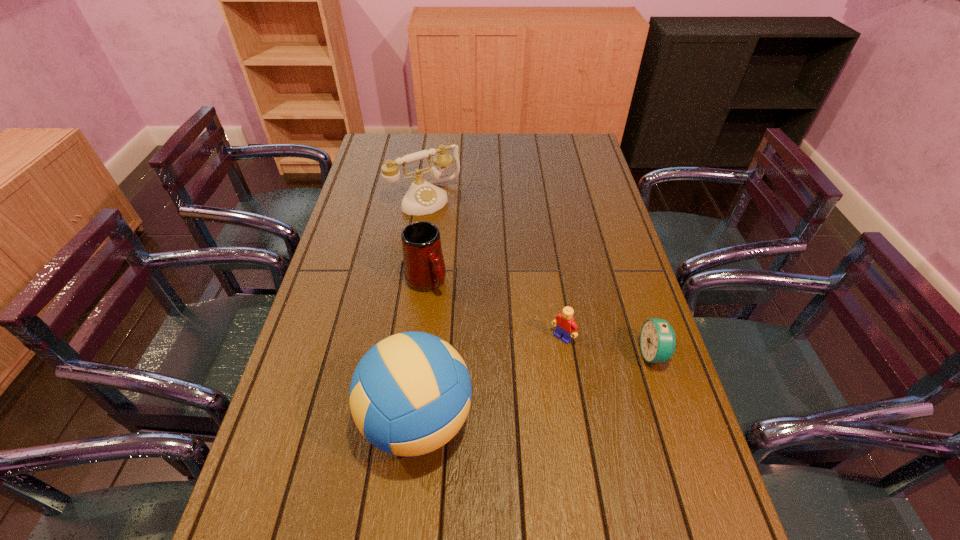
Locate an element on the screen. This screenshot has width=960, height=540. free point between the alarm clock and the second farthest object is located at coordinates coord(540,318).

The image size is (960, 540). I want to click on vacant area that lies between the alarm clock and the mug, so click(x=540, y=318).

Find the location of a particular element. Image resolution: width=960 pixels, height=540 pixels. free spot between the volleyball and the telephone is located at coordinates (421, 309).

The width and height of the screenshot is (960, 540). What are the coordinates of `object that is the second closest to the rightmost object` in the screenshot? It's located at (410, 394).

This screenshot has height=540, width=960. I want to click on object that is the third closest to the volleyball, so click(x=657, y=338).

I want to click on vacant region that satisfies the following two spatial constraints: 1. on the front side of the fourth object from left to right; 2. on the left side of the mug, so click(x=420, y=338).

Identify the location of vacant area that satisfies the following two spatial constraints: 1. on the front side of the mug; 2. on the left side of the tallest object. The width and height of the screenshot is (960, 540). 410,420.

You are a GUI agent. You are given a task and a screenshot of the screen. Output one action in this format:
    pyautogui.click(x=<x>, y=<y>)
    Task: Click on the vacant position in the image that satisfies the following two spatial constraints: 1. on the back side of the alarm clock; 2. on the front-facing side of the tallest object
    The image size is (960, 540).
    Given the screenshot: What is the action you would take?
    pyautogui.click(x=424, y=354)